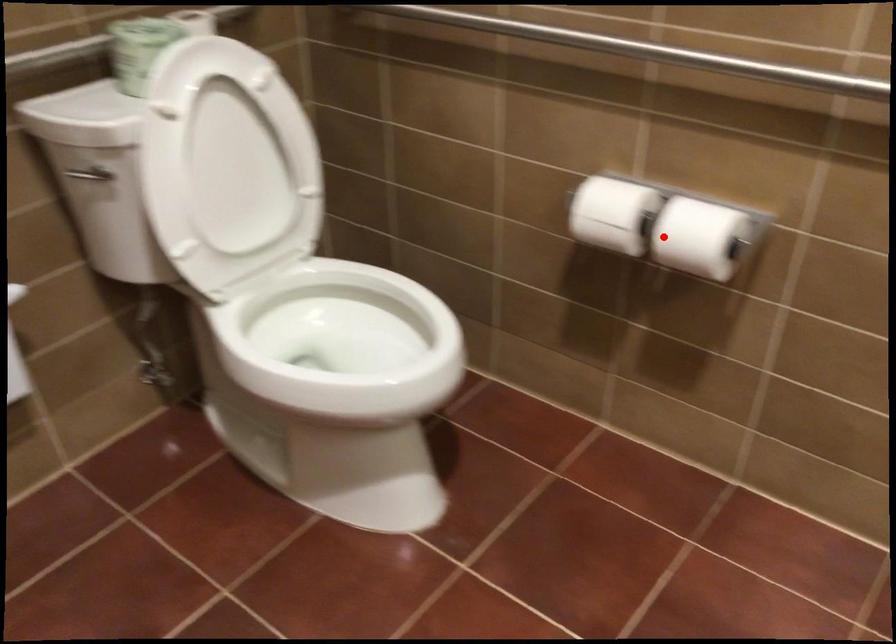
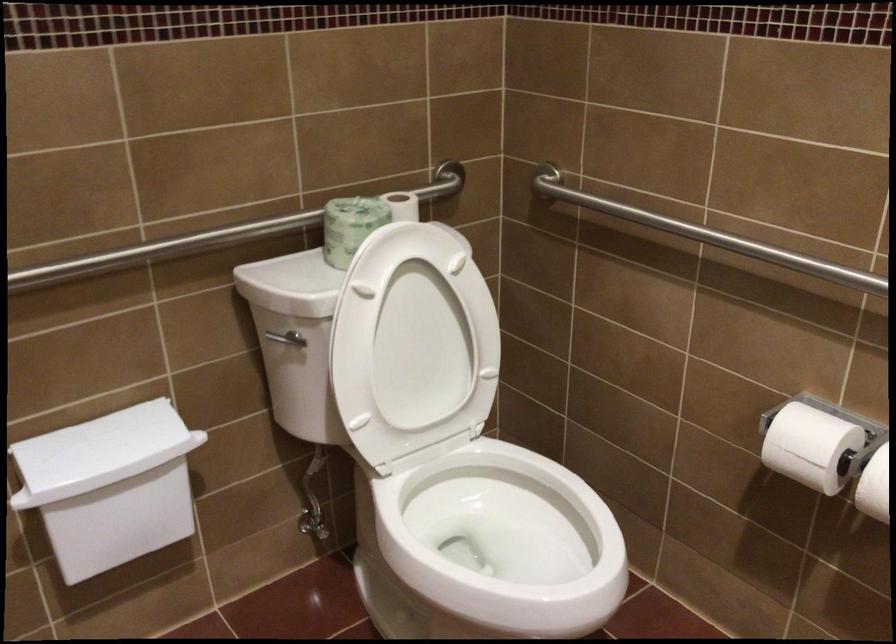
Question: I am providing you with two images of the same scene from different viewpoints. A red point is marked on the first image. Is the red point's position out of view in image 2?

Choices:
 (A) Yes
 (B) No

Answer: (B)